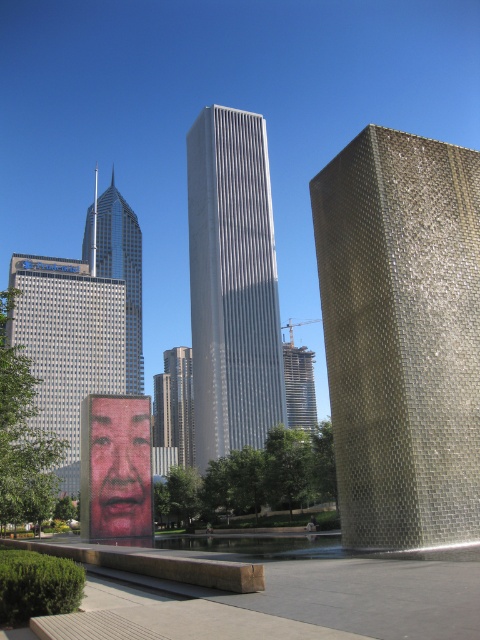
Question: Is pink matte face at center bigger than shiny silver skyscraper at center?

Choices:
 (A) no
 (B) yes

Answer: (A)

Question: Estimate the real-world distances between objects in this image. Which object is closer to the matte glass skyscraper at center?

Choices:
 (A) brick-like textured wall at right
 (B) pink matte face at center
 (C) reflective glass skyscraper at center

Answer: (C)

Question: Which object appears closest to the camera in this image?

Choices:
 (A) glassy steel skyscraper at center
 (B) silver glass skyscraper at center
 (C) reflective glass skyscraper at center

Answer: (B)

Question: Which point is closer to the camera?

Choices:
 (A) (436, 504)
 (B) (69, 289)
 (C) (113, 273)

Answer: (A)

Question: From the image, what is the correct spatial relationship of matte glass skyscraper at center in relation to reflective glass skyscraper at center?

Choices:
 (A) below
 (B) above

Answer: (B)

Question: Can you confirm if silver glass skyscraper at center is wider than glassy steel skyscraper at center?

Choices:
 (A) no
 (B) yes

Answer: (A)